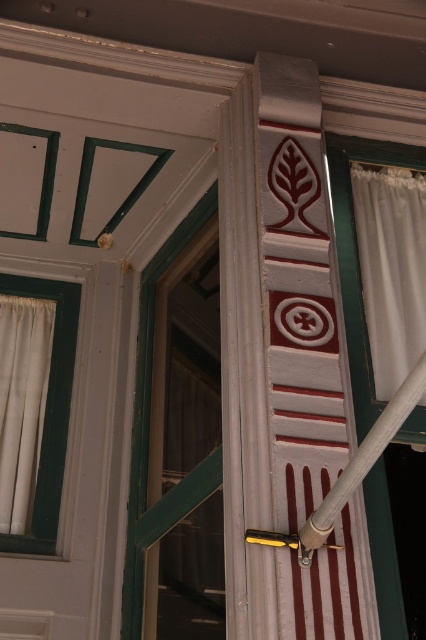
Is green painted wood window at center bigger than gray matte pole at center?

Yes, green painted wood window at center is bigger than gray matte pole at center.

Which is behind, point (140, 342) or point (368, 442)?

Point (140, 342)

This screenshot has height=640, width=426. What are the coordinates of `green painted wood window at center` in the screenshot? It's located at (149, 401).

Can you confirm if white fabric curtain at right is taller than gray matte pole at center?

Indeed, white fabric curtain at right has a greater height compared to gray matte pole at center.

Which is more to the right, white fabric curtain at right or gray matte pole at center?

From the viewer's perspective, white fabric curtain at right appears more on the right side.

Which is in front, point (416, 356) or point (373, 458)?

Point (373, 458)

Image resolution: width=426 pixels, height=640 pixels. What are the coordinates of `white fabric curtain at right` in the screenshot? It's located at (391, 268).

Which is more to the right, white fabric curtain at right or green painted wood window at center?

white fabric curtain at right is more to the right.

Is white fabric curtain at right below green painted wood window at center?

No.

Does point (356, 204) lie in front of point (144, 381)?

Yes, point (356, 204) is closer to viewer.

Locate an element on the screen. Image resolution: width=426 pixels, height=640 pixels. white fabric curtain at right is located at coordinates (391, 268).